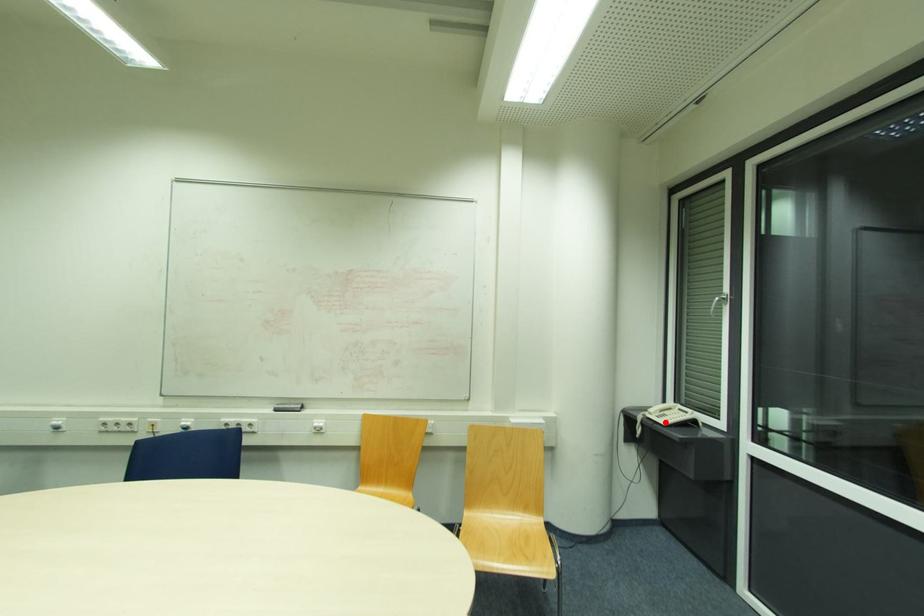
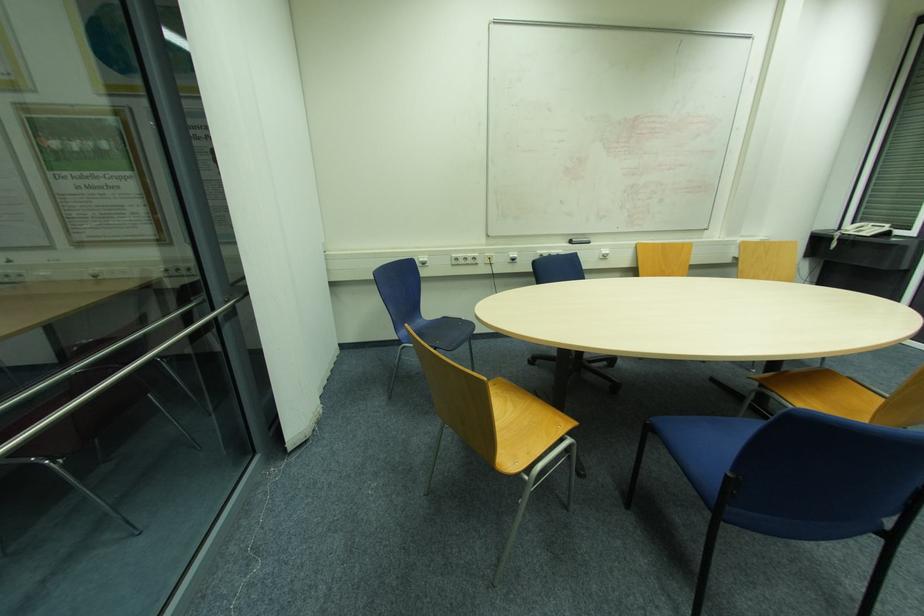
Find the pixel in the second image that matches the highlighted location in the first image.

(869, 233)